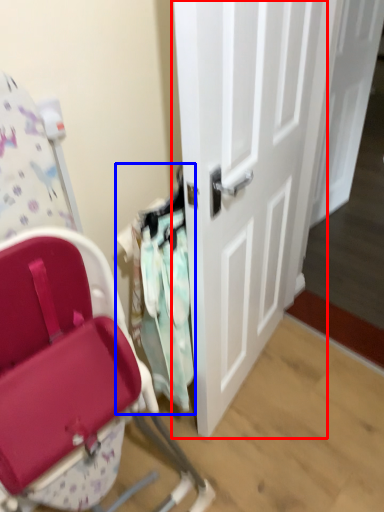
Question: Among these objects, which one is nearest to the camera, door (highlighted by a red box) or laundry (highlighted by a blue box)?

Choices:
 (A) door
 (B) laundry

Answer: (A)